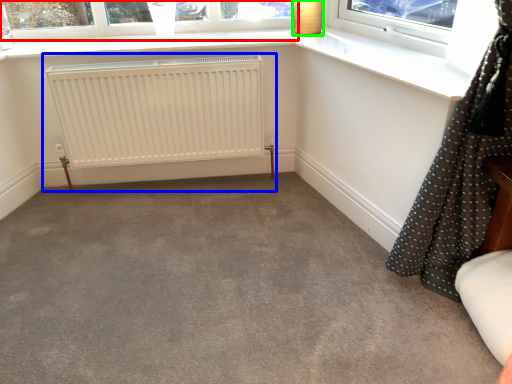
Question: Estimate the real-world distances between objects in this image. Which object is farther from window (highlighted by a red box), radiator (highlighted by a blue box) or lamp (highlighted by a green box)?

Choices:
 (A) radiator
 (B) lamp

Answer: (B)